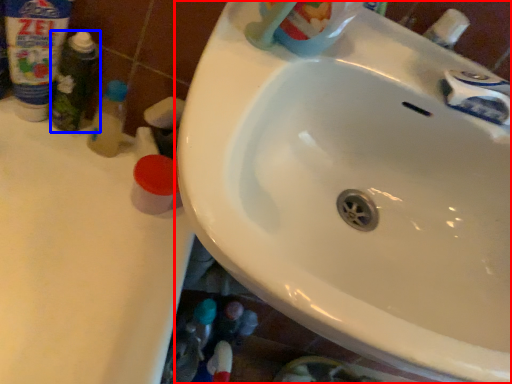
Question: Which of the following is the farthest to the observer, sink (highlighted by a red box) or toiletry (highlighted by a blue box)?

Choices:
 (A) sink
 (B) toiletry

Answer: (B)